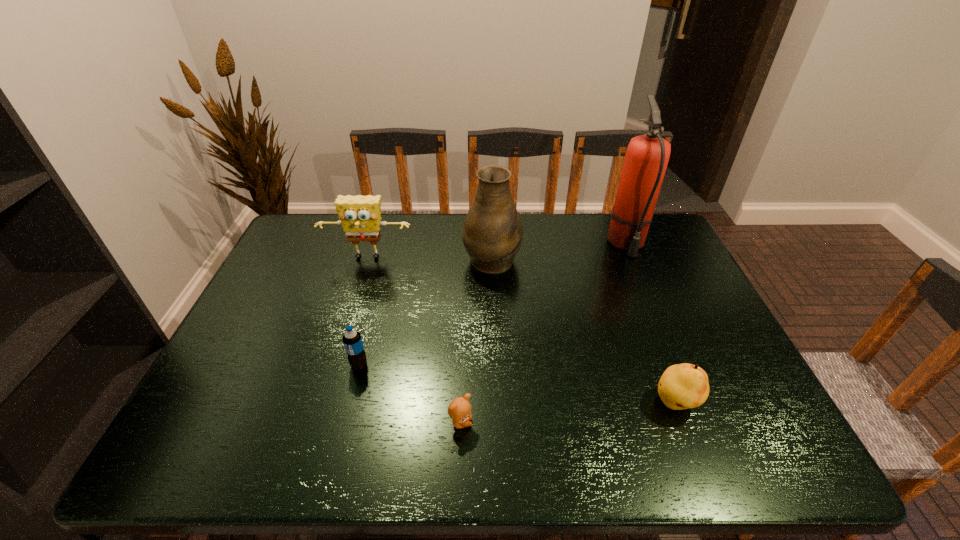
Find the location of `free spot between the pear and the soda bottle`. free spot between the pear and the soda bottle is located at coordinates (517, 384).

Locate an element on the screen. empty space that is in between the teddy bear and the second tallest object is located at coordinates (476, 340).

Locate an element on the screen. This screenshot has width=960, height=540. free space between the teddy bear and the sponge is located at coordinates (414, 340).

You are a GUI agent. You are given a task and a screenshot of the screen. Output one action in this format:
    pyautogui.click(x=<x>, y=<y>)
    Task: Click on the free space between the pear and the tallest object
    This screenshot has height=540, width=960.
    Given the screenshot: What is the action you would take?
    pyautogui.click(x=651, y=323)

The height and width of the screenshot is (540, 960). I want to click on vacant area between the sponge and the pitcher, so click(x=430, y=258).

Image resolution: width=960 pixels, height=540 pixels. In order to click on vacant space that is in between the second tallest object and the third nearest object in this screenshot , I will do `click(425, 311)`.

Identify the location of vacant space that's between the fourth farthest object and the pear. The image size is (960, 540). (517, 384).

Find the location of `object that stands as the fourth closest to the teddy bear`. object that stands as the fourth closest to the teddy bear is located at coordinates (359, 215).

Locate an element on the screen. object that is the second nearest to the teddy bear is located at coordinates (682, 386).

This screenshot has width=960, height=540. Identify the location of vacant position in the image that satisfies the following two spatial constraints: 1. on the face of the fourth shortest object; 2. on the left side of the soda bottle. (335, 365).